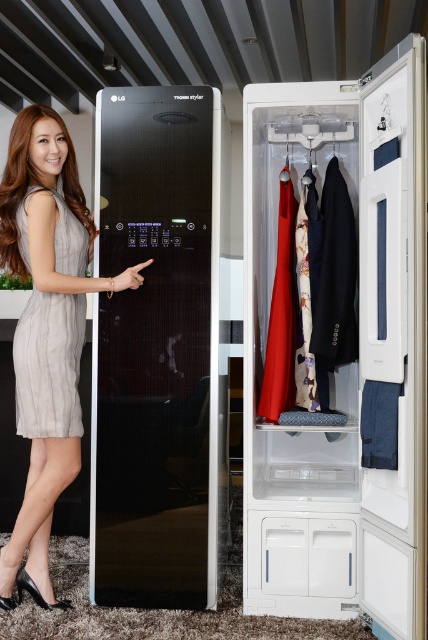
You are a fashion designer who wants to store a new silky red dress at center in the white plastic closet at center. Based on the scene, will the dress fit inside the closet?

The white plastic closet at center is bigger than silky red dress at center, so the dress will fit inside the closet.

From the picture: You are a fashion designer who wants to access the silky red dress at center. The white plastic closet at center is in the way. Can you reach the dress without moving the closet?

The white plastic closet at center is closer to the viewer than the silky red dress at center, so you cannot reach the dress without moving the closet.